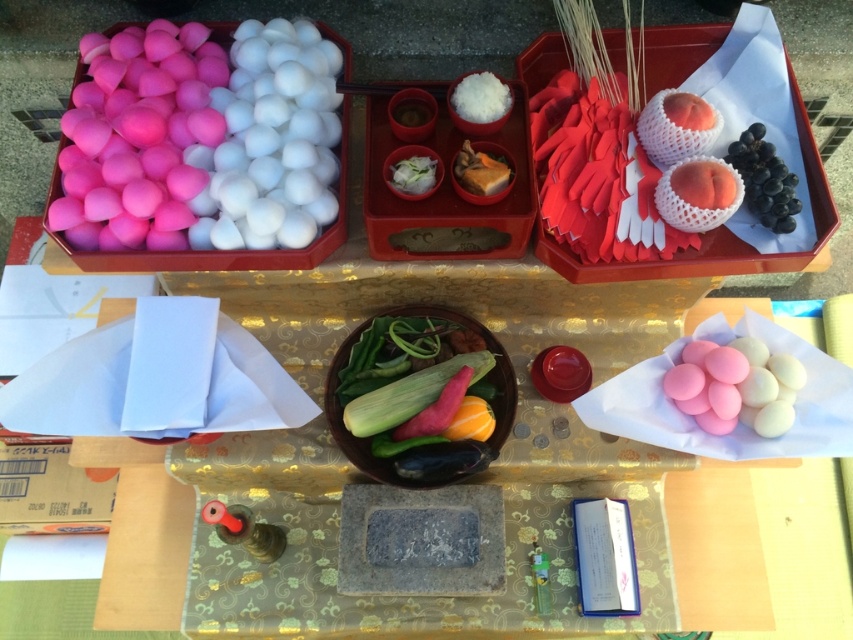
You are an event planner setting up for a cultural event. You have to place a small decorative item between the black glossy grapes at upper right and the white glossy bowl at center. Which object should the item be closer to if it needs to be near the smaller one?

The white glossy bowl at center is smaller than the black glossy grapes at upper right, so the item should be placed closer to the white glossy bowl at center.

You are a guest at a Shinto ceremony and need to place a small offering on the table. The pink matte candy at lower right and the black glossy grapes at upper right are already present. Which object is shorter in height?

The pink matte candy at lower right is not as tall as the black glossy grapes at upper right, so the pink matte candy at lower right is shorter in height.